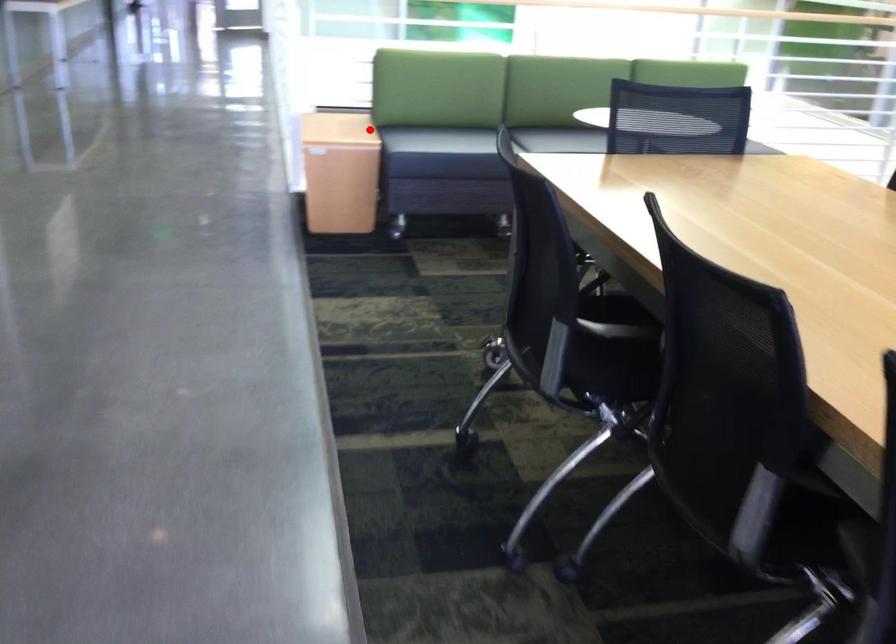
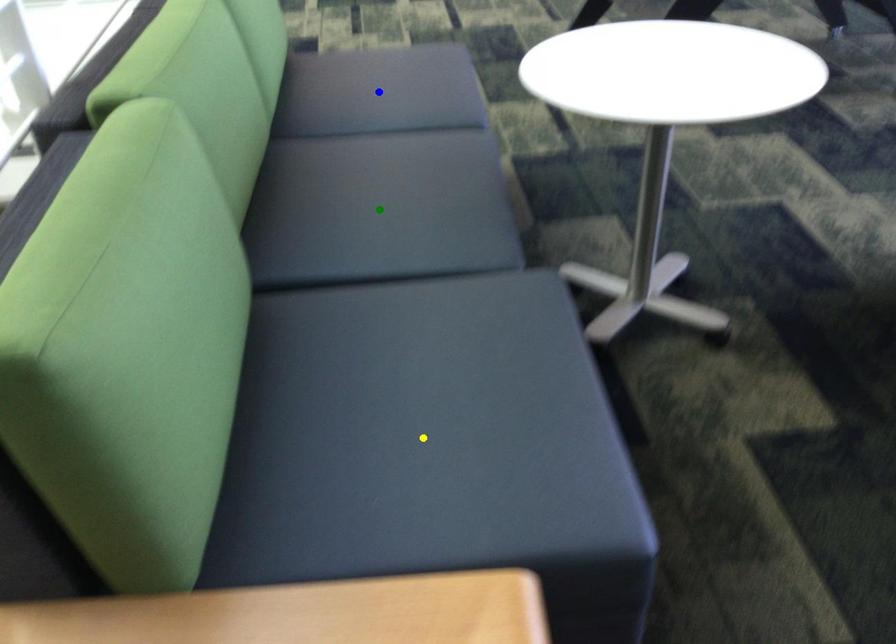
Question: I am providing you with two images of the same scene from different viewpoints. A red point is marked on the first image. You are given multiple points on the second image. In image 2, which mark is for the same physical point as the one in image 1?

Choices:
 (A) blue point
 (B) green point
 (C) yellow point

Answer: (C)